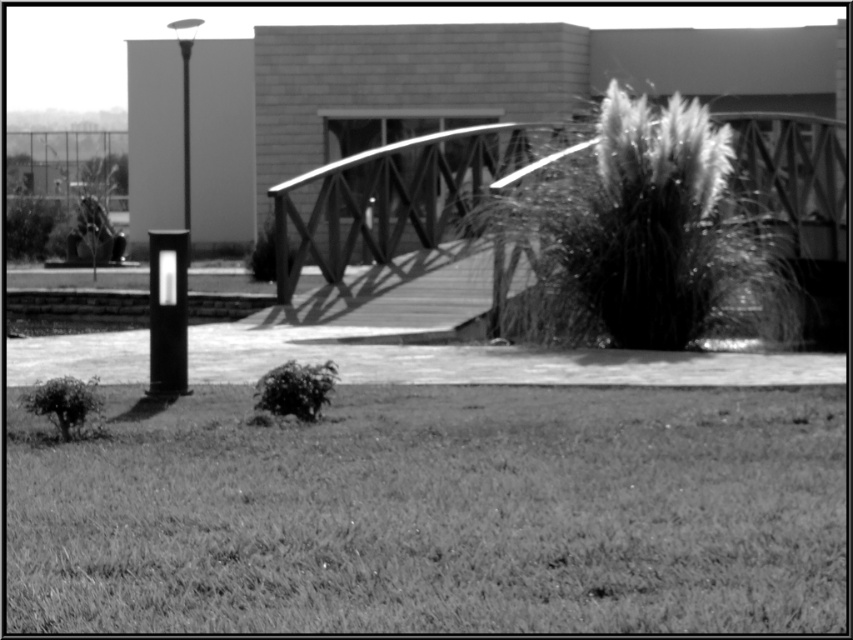
Does grassy lawn at lower center appear under smooth black post at left?

Correct, grassy lawn at lower center is located below smooth black post at left.

Who is taller, grassy lawn at lower center or smooth black post at left?

smooth black post at left is taller.

Between point (474, 458) and point (170, 340), which one is positioned in front?

Positioned in front is point (474, 458).

The width and height of the screenshot is (853, 640). Find the location of `grassy lawn at lower center`. grassy lawn at lower center is located at coordinates (436, 513).

How far apart are smooth black post at left and polished metal lamp post at left?

23.14 meters

Between point (154, 292) and point (184, 115), which one is positioned behind?

Point (184, 115)

What do you see at coordinates (167, 312) in the screenshot?
I see `smooth black post at left` at bounding box center [167, 312].

The image size is (853, 640). Find the location of `smooth black post at left`. smooth black post at left is located at coordinates (167, 312).

Does wooden bridge at center have a greater width compared to smooth black post at left?

Correct, the width of wooden bridge at center exceeds that of smooth black post at left.

Which of these two, wooden bridge at center or smooth black post at left, stands shorter?

Standing shorter between the two is smooth black post at left.

Is point (520, 168) positioned before point (157, 246)?

No.

Where is `wooden bridge at center`? This screenshot has width=853, height=640. wooden bridge at center is located at coordinates (398, 195).